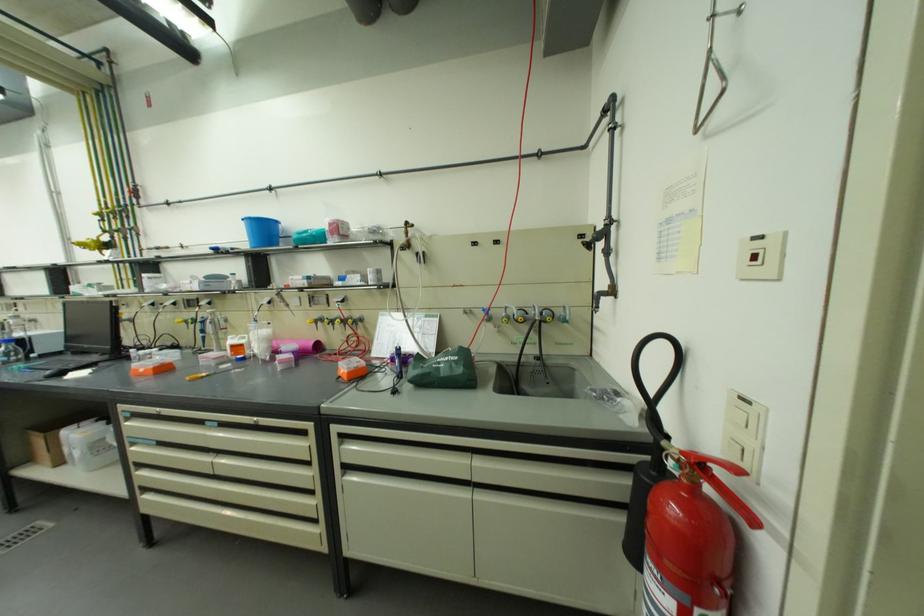
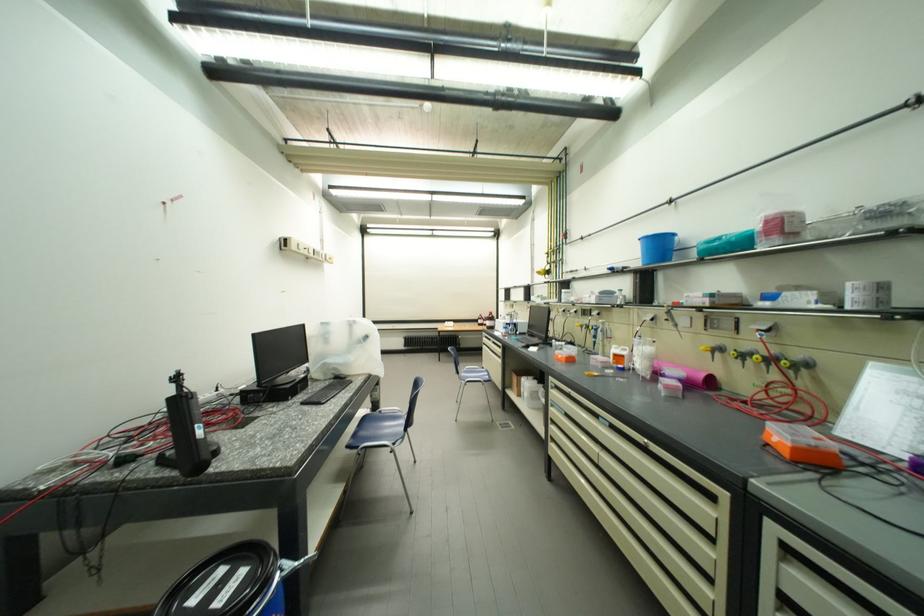
Locate, in the second image, the point that corresponds to pixel 318 323 in the first image.

(712, 350)